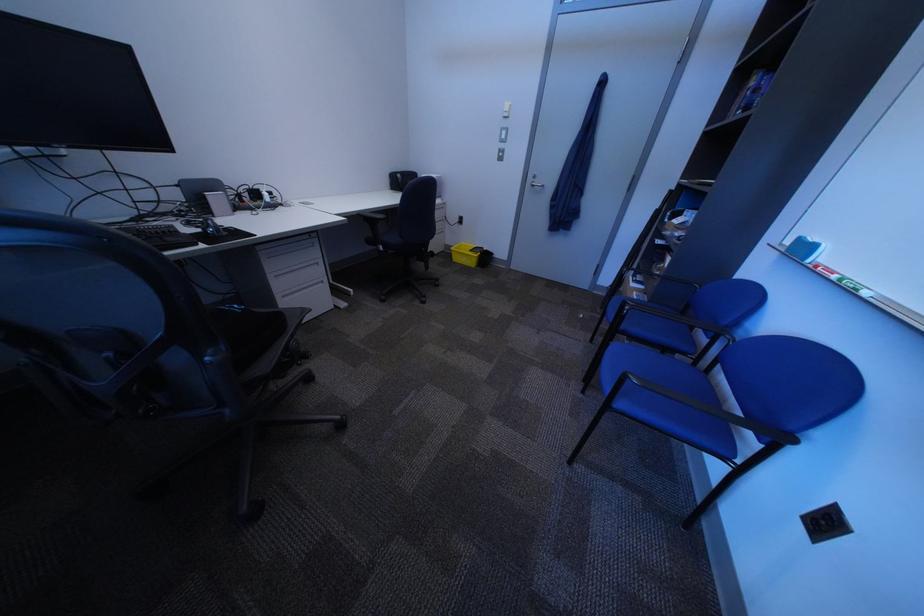
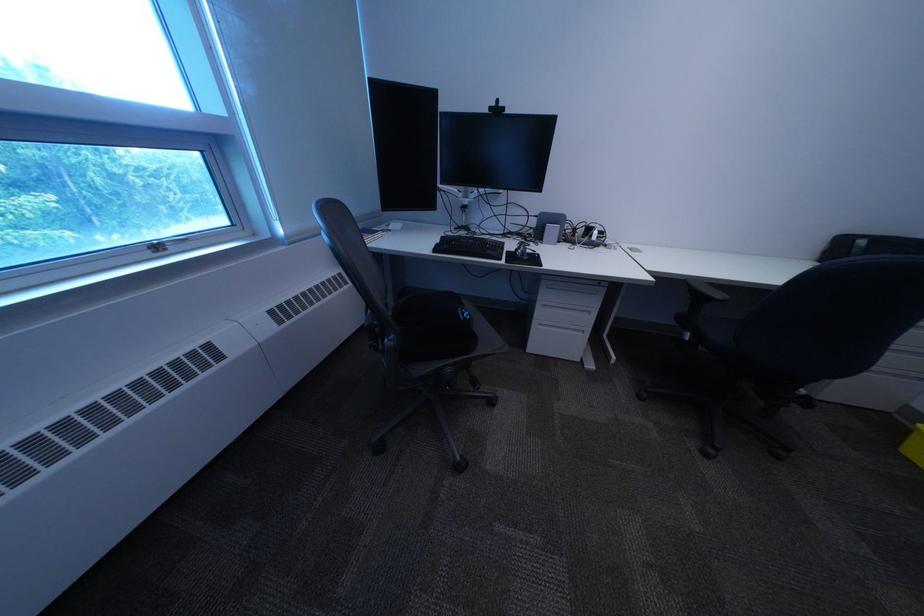
The point at (225, 353) is marked in the first image. Where is the corresponding point in the second image?

(407, 338)